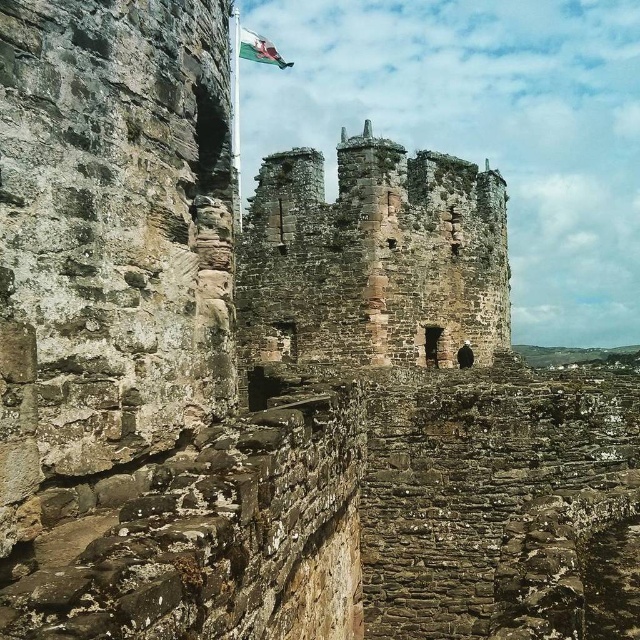
Question: Is rusty stone tower at center bigger than white fabric flag at upper center?

Choices:
 (A) yes
 (B) no

Answer: (A)

Question: Which of the following is the farthest from the observer?

Choices:
 (A) (262, 51)
 (B) (262, 170)

Answer: (A)

Question: In this image, where is rusty stone tower at center located relative to white fabric flag at upper center?

Choices:
 (A) left
 (B) right

Answer: (B)

Question: Which point is farther from the camera taking this photo?

Choices:
 (A) (237, 44)
 (B) (300, 150)

Answer: (A)

Question: Is rusty stone tower at center thinner than white fabric flag at upper center?

Choices:
 (A) no
 (B) yes

Answer: (A)